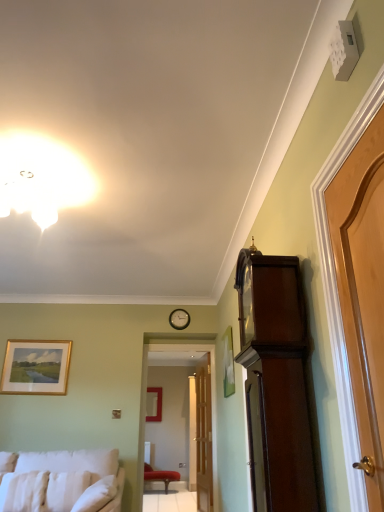
Question: Can you see wooden clock at center touching white fabric studio couch at lower left?

Choices:
 (A) no
 (B) yes

Answer: (A)

Question: Considering the relative sizes of wooden clock at center and white fabric studio couch at lower left in the image provided, is wooden clock at center smaller than white fabric studio couch at lower left?

Choices:
 (A) yes
 (B) no

Answer: (A)

Question: Does wooden clock at center have a greater width compared to white fabric studio couch at lower left?

Choices:
 (A) no
 (B) yes

Answer: (A)

Question: Is wooden clock at center looking in the opposite direction of white fabric studio couch at lower left?

Choices:
 (A) no
 (B) yes

Answer: (A)

Question: Considering the relative sizes of wooden clock at center and white fabric studio couch at lower left in the image provided, is wooden clock at center bigger than white fabric studio couch at lower left?

Choices:
 (A) yes
 (B) no

Answer: (B)

Question: Is white soft pillow at lower left, which is counted as the 3th pillow, starting from the left, in front of or behind velvet red chair at center in the image?

Choices:
 (A) behind
 (B) front

Answer: (B)

Question: From the image's perspective, relative to velvet red chair at center, is white soft pillow at lower left, positioned as the 1th pillow in right-to-left order, above or below?

Choices:
 (A) above
 (B) below

Answer: (A)

Question: In terms of size, does white soft pillow at lower left, which is counted as the 3th pillow, starting from the left, appear bigger or smaller than velvet red chair at center?

Choices:
 (A) small
 (B) big

Answer: (A)

Question: Is white soft pillow at lower left, which is counted as the 3th pillow, starting from the left, wider or thinner than velvet red chair at center?

Choices:
 (A) wide
 (B) thin

Answer: (B)

Question: Considering the positions of white fluffy pillow at lower left, the second pillow positioned from the left, and matte gold picture frame at center, the 2th picture frame from the top, in the image, is white fluffy pillow at lower left, the second pillow positioned from the left, taller or shorter than matte gold picture frame at center, the 2th picture frame from the top,?

Choices:
 (A) short
 (B) tall

Answer: (A)

Question: From a real-world perspective, relative to matte gold picture frame at center, which is counted as the 1th picture frame, starting from the right, is white fluffy pillow at lower left, the second pillow from the right, vertically above or below?

Choices:
 (A) below
 (B) above

Answer: (A)

Question: Is point (72, 499) closer or farther from the camera than point (150, 402)?

Choices:
 (A) closer
 (B) farther

Answer: (A)

Question: Looking at their shapes, would you say white fluffy pillow at lower left, the second pillow from the right, is wider or thinner than matte gold picture frame at center, placed as the 1th picture frame when sorted from bottom to top?

Choices:
 (A) thin
 (B) wide

Answer: (B)

Question: In terms of height, does mahogany wood grandfather clock at right look taller or shorter compared to light brown wooden door at right, which ranks as the first door in top-to-bottom order?

Choices:
 (A) short
 (B) tall

Answer: (B)

Question: Considering the positions of mahogany wood grandfather clock at right and light brown wooden door at right, the 2th door positioned from the bottom, in the image, is mahogany wood grandfather clock at right wider or thinner than light brown wooden door at right, the 2th door positioned from the bottom,?

Choices:
 (A) wide
 (B) thin

Answer: (A)